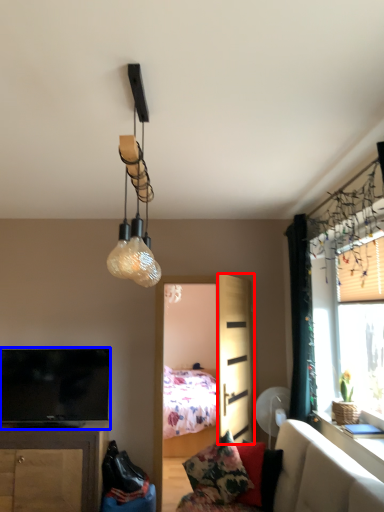
Question: Which object appears farthest to the camera in this image, screen door (highlighted by a red box) or television (highlighted by a blue box)?

Choices:
 (A) screen door
 (B) television

Answer: (B)